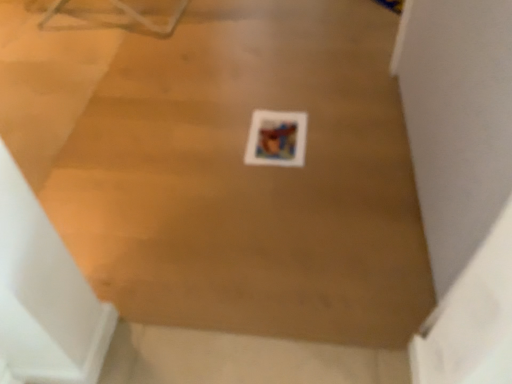
The height and width of the screenshot is (384, 512). What are the coordinates of `vacant region to the left of matte paper print at center` in the screenshot? It's located at (216, 138).